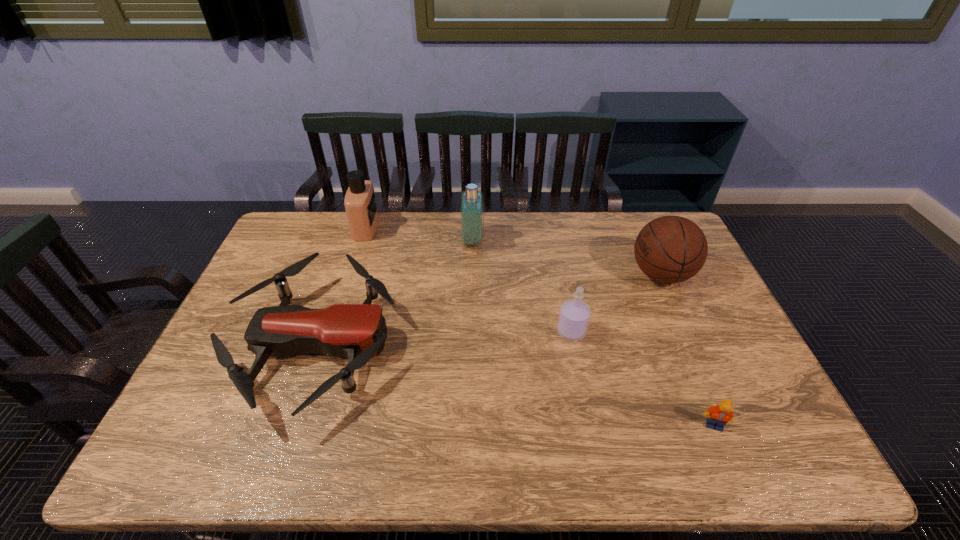
In order to click on vacant space positioned 0.210m on the side with brand label of the basketball in this screenshot , I will do `click(564, 274)`.

The height and width of the screenshot is (540, 960). Identify the location of vacant space located on the side with brand label of the basketball. (524, 274).

I want to click on vacant space positioned 0.260m on the back of the nearest perfume, so click(x=558, y=262).

Where is `free space located on the front-facing side of the drone`? The width and height of the screenshot is (960, 540). free space located on the front-facing side of the drone is located at coordinates (464, 343).

The width and height of the screenshot is (960, 540). I want to click on vacant space situated on the front-facing side of the Lego, so click(725, 453).

At what (x,y) coordinates should I click in order to perform the action: click on drone that is at the near edge. Please return your answer as a coordinate pair (x, y). Looking at the image, I should click on (357, 331).

The image size is (960, 540). Identify the location of Lego that is at the near edge. point(719,415).

You are a GUI agent. You are given a task and a screenshot of the screen. Output one action in this format:
    pyautogui.click(x=<x>, y=<y>)
    Task: Click on the object located in the left edge section of the desktop
    This screenshot has width=960, height=540.
    Given the screenshot: What is the action you would take?
    pyautogui.click(x=357, y=331)

You are a GUI agent. You are given a task and a screenshot of the screen. Output one action in this format:
    pyautogui.click(x=<x>, y=<y>)
    Task: Click on the basketball situated at the right edge
    The image size is (960, 540).
    Given the screenshot: What is the action you would take?
    pyautogui.click(x=671, y=249)

Where is `Lego that is at the right edge`? The height and width of the screenshot is (540, 960). Lego that is at the right edge is located at coordinates (719, 415).